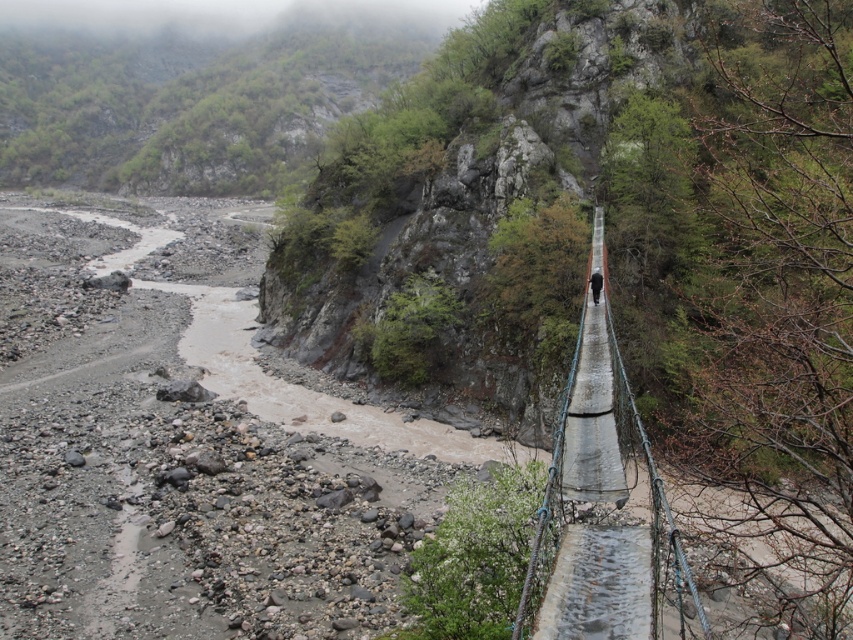
In the scene shown: Can you confirm if concrete/wooden suspension bridge at center is positioned to the left of black fabric person at center?

Yes, concrete/wooden suspension bridge at center is to the left of black fabric person at center.

Looking at this image, can you confirm if concrete/wooden suspension bridge at center is bigger than black fabric person at center?

Yes, concrete/wooden suspension bridge at center is bigger than black fabric person at center.

Where is `concrete/wooden suspension bridge at center`? This screenshot has height=640, width=853. concrete/wooden suspension bridge at center is located at coordinates (604, 508).